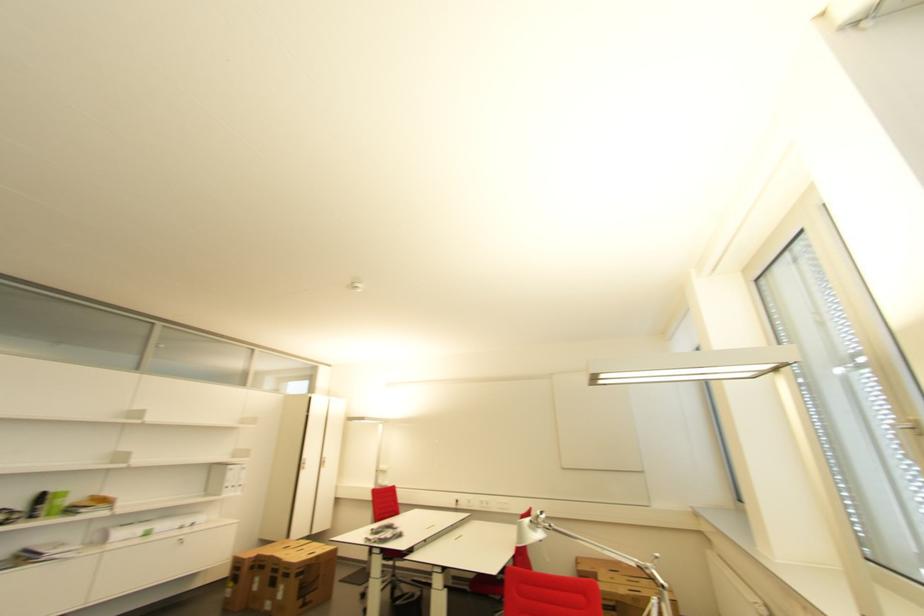
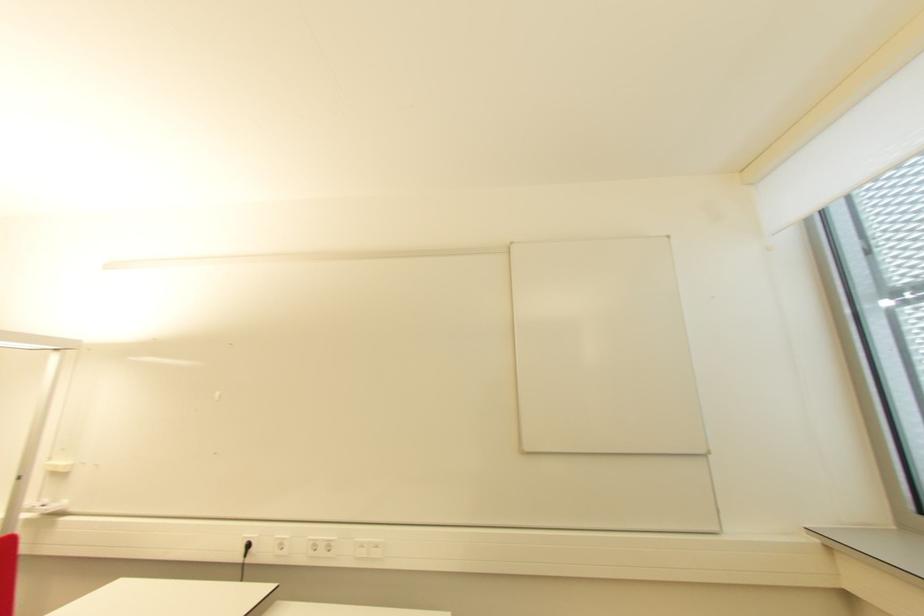
Question: In a continuous first-person perspective shot, in which direction is the camera moving?

Choices:
 (A) Left
 (B) Right
 (C) Forward
 (D) Backward

Answer: (C)